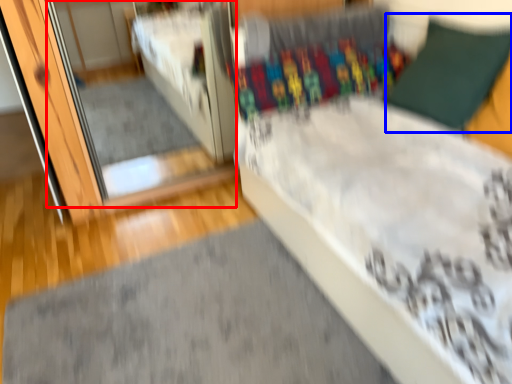
Question: Which object is further to the camera taking this photo, mirror (highlighted by a red box) or pillow (highlighted by a blue box)?

Choices:
 (A) mirror
 (B) pillow

Answer: (A)